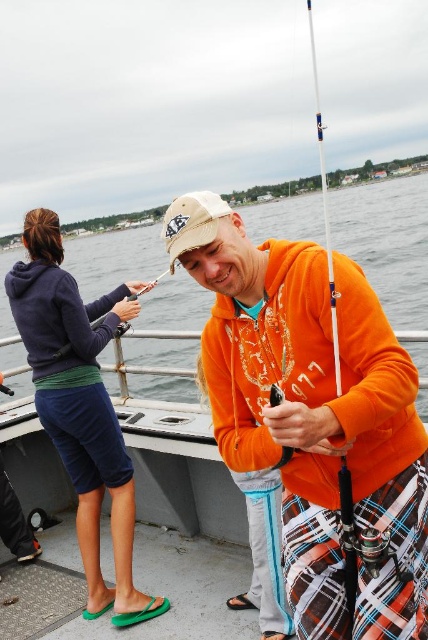
Consider the image. Can you confirm if orange fleece at center is taller than matte orange hoodie at center?

In fact, orange fleece at center may be shorter than matte orange hoodie at center.

Between orange fleece at center and matte orange hoodie at center, which one appears on the left side from the viewer's perspective?

orange fleece at center

You are a GUI agent. You are given a task and a screenshot of the screen. Output one action in this format:
    pyautogui.click(x=<x>, y=<y>)
    Task: Click on the orange fleece at center
    
    Given the screenshot: What is the action you would take?
    pyautogui.click(x=314, y=413)

The image size is (428, 640). In order to click on orange fleece at center in this screenshot , I will do `click(314, 413)`.

Where is `white plastic fishing pole at right`? white plastic fishing pole at right is located at coordinates (324, 209).

Can you confirm if white plastic fishing pole at right is shorter than khaki fabric baseball cap at center?

Incorrect, white plastic fishing pole at right's height does not fall short of khaki fabric baseball cap at center's.

Which is behind, point (338, 364) or point (195, 230)?

The point (195, 230) is more distant.

You are a GUI agent. You are given a task and a screenshot of the screen. Output one action in this format:
    pyautogui.click(x=<x>, y=<y>)
    Task: Click on the white plastic fishing pole at right
    
    Given the screenshot: What is the action you would take?
    click(324, 209)

Who is positioned more to the left, matte orange hoodie at center or khaki fabric baseball cap at center?

From the viewer's perspective, khaki fabric baseball cap at center appears more on the left side.

Who is positioned more to the right, matte orange hoodie at center or khaki fabric baseball cap at center?

matte orange hoodie at center is more to the right.

This screenshot has height=640, width=428. I want to click on matte orange hoodie at center, so click(x=388, y=243).